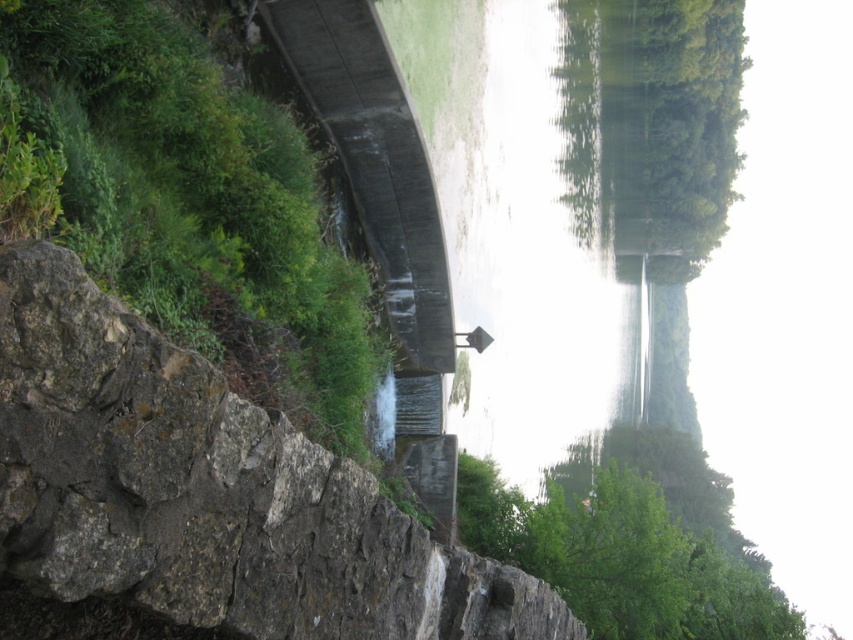
You are standing on the dam and want to move towards the green leafy tree at lower right. Which direction should you walk to avoid the brown rough stone at center?

You should walk to the right side of the green leafy tree at lower right since the brown rough stone at center is positioned on the left side of it.

You are a gardener who needs to decide which area to prune first. Based on the scene, which of the two green leafy areas, the green leafy vegetation at lower left or the green leafy tree at lower right, requires more attention due to overgrowth?

The green leafy tree at lower right requires more attention because it is thicker than the green leafy vegetation at lower left, indicating potential overgrowth.